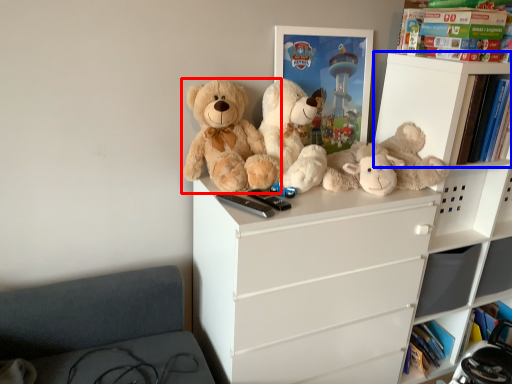
Question: Which point is closer to the camera, teddy bear (highlighted by a red box) or shelf (highlighted by a blue box)?

Choices:
 (A) teddy bear
 (B) shelf

Answer: (A)